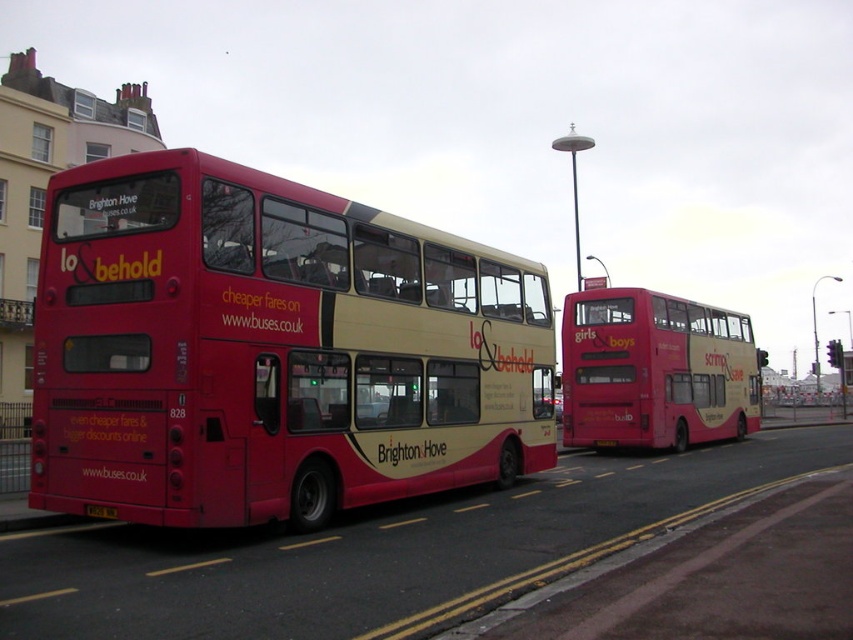
Question: Can you confirm if matte red bus at left is wider than matte pink bus at center?

Choices:
 (A) yes
 (B) no

Answer: (A)

Question: Observing the image, what is the correct spatial positioning of matte red bus at left in reference to matte pink bus at center?

Choices:
 (A) left
 (B) right

Answer: (A)

Question: Which object is closer to the camera taking this photo?

Choices:
 (A) matte pink bus at center
 (B) black plastic license plate at rear
 (C) matte red bus at left

Answer: (C)

Question: Does matte red bus at left appear under black plastic license plate at rear?

Choices:
 (A) no
 (B) yes

Answer: (A)

Question: Which object is the farthest from the matte pink bus at center?

Choices:
 (A) black plastic license plate at rear
 (B) matte red bus at left

Answer: (A)

Question: Which object is the closest to the black plastic license plate at rear?

Choices:
 (A) matte red bus at left
 (B) matte pink bus at center

Answer: (A)